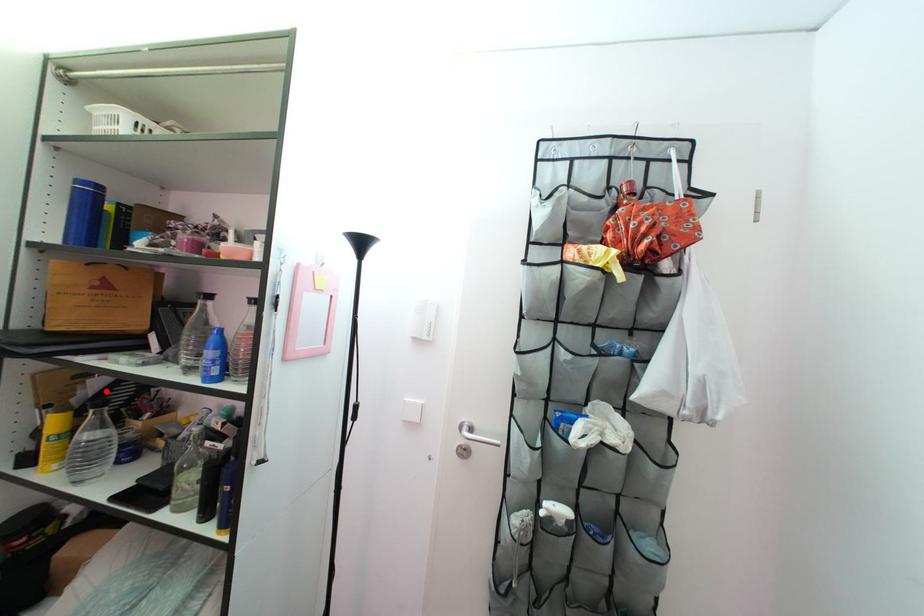
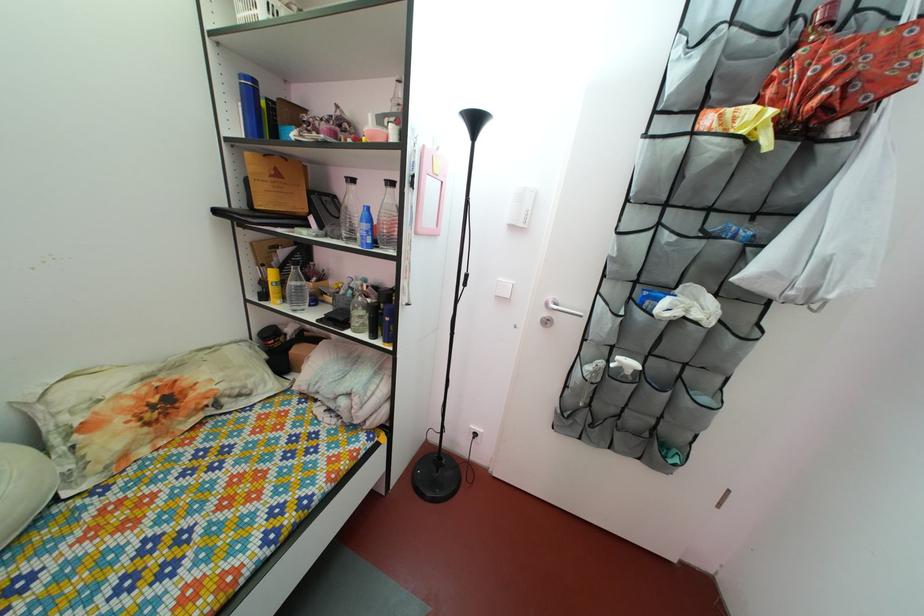
The point at the highlighted location is marked in the first image. Where is the corresponding point in the second image?

(292, 262)